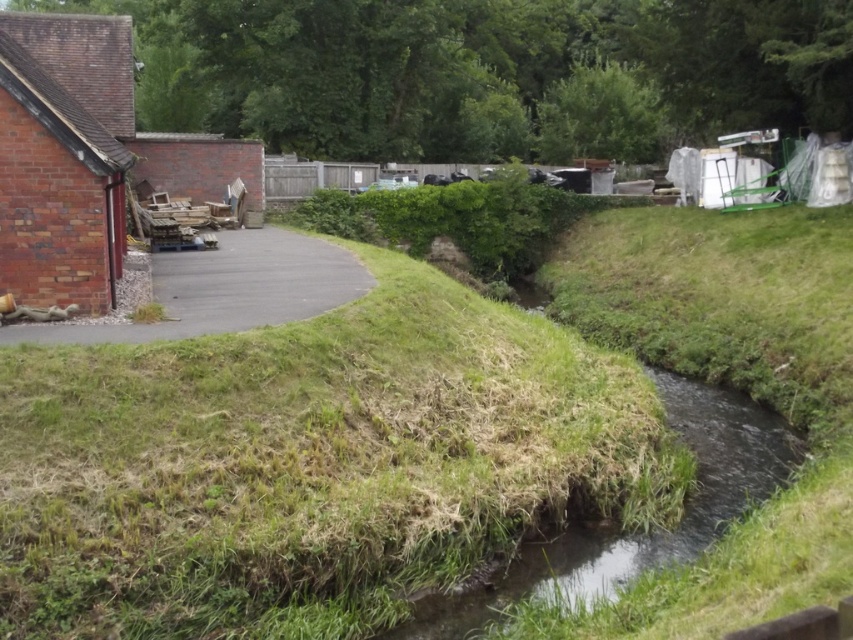
You are a gardener planning to install a new sprinkler system to water the green grass at center and asphalt road at left. Which area requires more immediate attention based on their positions relative to each other?

The green grass at center requires more immediate attention because it is positioned under the asphalt road at left, which may block water and sunlight from reaching it, making it harder to maintain.

In the scene shown: You are standing in the rural scene and want to cross the stream without getting your shoes wet. The green grassy stream at lower right and the asphalt road at left are in your path. Which path should you take to avoid the water?

You should take the asphalt road at left because the green grassy stream at lower right is closer to the viewer, meaning the stream is in front of you and the road is further back. To avoid the water, move towards the asphalt road at left which is behind the stream.

You are a gardener planning to water the green grass at center and the green grassy stream at lower right. Which area requires more water based on their sizes?

The green grass at center might be wider than the green grassy stream at lower right, so it likely requires more water.